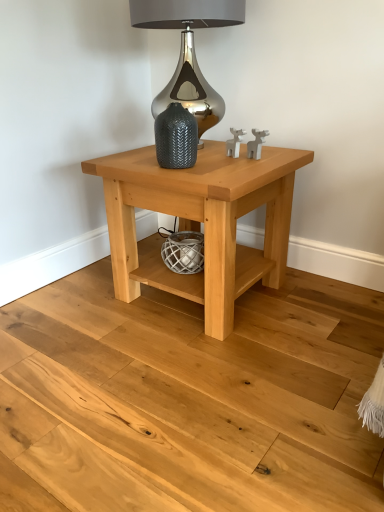
What do you see at coordinates (200, 222) in the screenshot?
I see `natural wood table at center` at bounding box center [200, 222].

At what (x,y) coordinates should I click in order to perform the action: click on satin silver lamp at upper center. Please return your answer as a coordinate pair (x, y). Looking at the image, I should click on (188, 51).

Locate an element on the screen. The image size is (384, 512). white textured basket at lower center is located at coordinates (184, 252).

Consider the image. Can you confirm if natural wood floor at lower center is bigger than textured gray vase at center?

Yes.

You are a GUI agent. You are given a task and a screenshot of the screen. Output one action in this format:
    pyautogui.click(x=<x>, y=<y>)
    Task: Click on the vase above the natural wood floor at lower center (from a real-world perspective)
    This screenshot has width=384, height=512.
    Given the screenshot: What is the action you would take?
    pyautogui.click(x=176, y=137)

How different are the orientations of natural wood floor at lower center and textured gray vase at center in degrees?

116 degrees separate the facing orientations of natural wood floor at lower center and textured gray vase at center.

Is natural wood table at center wider or thinner than satin silver lamp at upper center?

natural wood table at center is wider than satin silver lamp at upper center.

In the scene shown: Considering the relative sizes of natural wood table at center and satin silver lamp at upper center in the image provided, is natural wood table at center shorter than satin silver lamp at upper center?

No.

Would you say natural wood table at center is a long distance from satin silver lamp at upper center?

They are positioned close to each other.

How much distance is there between natural wood table at center and satin silver lamp at upper center?

They are 22.41 inches apart.

Does natural wood table at center have a greater width compared to textured gray vase at center?

Correct, the width of natural wood table at center exceeds that of textured gray vase at center.

Which of these two, natural wood table at center or textured gray vase at center, stands shorter?

With less height is textured gray vase at center.

Is natural wood table at center oriented towards textured gray vase at center?

No, natural wood table at center is not facing towards textured gray vase at center.

Between natural wood table at center and textured gray vase at center, which one has larger size?

With larger size is natural wood table at center.

From a real-world perspective, which object stands above the other?

satin silver lamp at upper center, from a real-world perspective.

From the image's perspective, is satin silver lamp at upper center above natural wood floor at lower center?

Yes, from the image's perspective, satin silver lamp at upper center is on top of natural wood floor at lower center.

From their relative heights in the image, would you say satin silver lamp at upper center is taller or shorter than natural wood floor at lower center?

satin silver lamp at upper center is taller than natural wood floor at lower center.

Looking at this image, is satin silver lamp at upper center at the left side of natural wood floor at lower center?

Incorrect, satin silver lamp at upper center is not on the left side of natural wood floor at lower center.

Does point (167, 109) come closer to viewer compared to point (348, 406)?

That is False.

In the scene shown: Is textured gray vase at center touching natural wood floor at lower center?

No, textured gray vase at center is not with natural wood floor at lower center.

Can you tell me how much textured gray vase at center and natural wood floor at lower center differ in facing direction?

textured gray vase at center and natural wood floor at lower center are facing 116 degrees away from each other.

From a real-world perspective, is textured gray vase at center positioned above or below natural wood floor at lower center?

From a real-world perspective, textured gray vase at center is physically above natural wood floor at lower center.

From a real-world perspective, relative to natural wood table at center, is textured gray vase at center vertically above or below?

Clearly, from a real-world perspective, textured gray vase at center is above natural wood table at center.

At what (x,y) coordinates should I click in order to perform the action: click on table below the textured gray vase at center (from a real-world perspective). Please return your answer as a coordinate pair (x, y). The image size is (384, 512). Looking at the image, I should click on (200, 222).

Looking at the image, does textured gray vase at center seem bigger or smaller compared to natural wood table at center?

Clearly, textured gray vase at center is smaller in size than natural wood table at center.

Can you see textured gray vase at center touching natural wood table at center?

No, textured gray vase at center is not with natural wood table at center.

Who is more distant, white textured basket at lower center or satin silver lamp at upper center?

Positioned behind is white textured basket at lower center.

Can you tell me how much white textured basket at lower center and satin silver lamp at upper center differ in facing direction?

white textured basket at lower center and satin silver lamp at upper center are facing 3.87 degrees away from each other.

Is white textured basket at lower center next to satin silver lamp at upper center and touching it?

white textured basket at lower center is not next to satin silver lamp at upper center, and they're not touching.

Which is in front, point (174, 251) or point (190, 101)?

The point (174, 251) is in front.

The image size is (384, 512). I want to click on stair below the textured gray vase at center (from the image's perspective), so click(193, 397).

You are a GUI agent. You are given a task and a screenshot of the screen. Output one action in this format:
    pyautogui.click(x=<x>, y=<y>)
    Task: Click on the table in front of the satin silver lamp at upper center
    The height and width of the screenshot is (512, 384).
    Given the screenshot: What is the action you would take?
    pyautogui.click(x=200, y=222)

Considering their positions, is natural wood floor at lower center positioned further to textured gray vase at center than satin silver lamp at upper center?

The object further to textured gray vase at center is natural wood floor at lower center.

Considering their positions, is white textured basket at lower center positioned further to natural wood floor at lower center than textured gray vase at center?

textured gray vase at center.

Considering their positions, is white textured basket at lower center positioned closer to satin silver lamp at upper center than natural wood floor at lower center?

white textured basket at lower center is positioned closer to the anchor satin silver lamp at upper center.

Which object lies nearer to the anchor point natural wood floor at lower center, natural wood table at center or satin silver lamp at upper center?

natural wood table at center is closer to natural wood floor at lower center.

From the image, which object appears to be nearer to satin silver lamp at upper center, natural wood floor at lower center or natural wood table at center?

natural wood table at center.

Looking at the image, which one is located further to satin silver lamp at upper center, natural wood table at center or white textured basket at lower center?

white textured basket at lower center.

When comparing their distances from natural wood table at center, does satin silver lamp at upper center or natural wood floor at lower center seem further?

satin silver lamp at upper center lies further to natural wood table at center than the other object.

Estimate the real-world distances between objects in this image. Which object is closer to natural wood table at center, satin silver lamp at upper center or white textured basket at lower center?

white textured basket at lower center lies closer to natural wood table at center than the other object.

The width and height of the screenshot is (384, 512). What are the coordinates of `table between satin silver lamp at upper center and white textured basket at lower center vertically` in the screenshot? It's located at [200, 222].

Locate an element on the screen. The height and width of the screenshot is (512, 384). table lamp positioned between natural wood floor at lower center and white textured basket at lower center from near to far is located at coordinates [188, 51].

The width and height of the screenshot is (384, 512). I want to click on table between textured gray vase at center and white textured basket at lower center from top to bottom, so click(x=200, y=222).

Find the location of a particular element. This screenshot has height=512, width=384. table between satin silver lamp at upper center and natural wood floor at lower center from top to bottom is located at coordinates (200, 222).